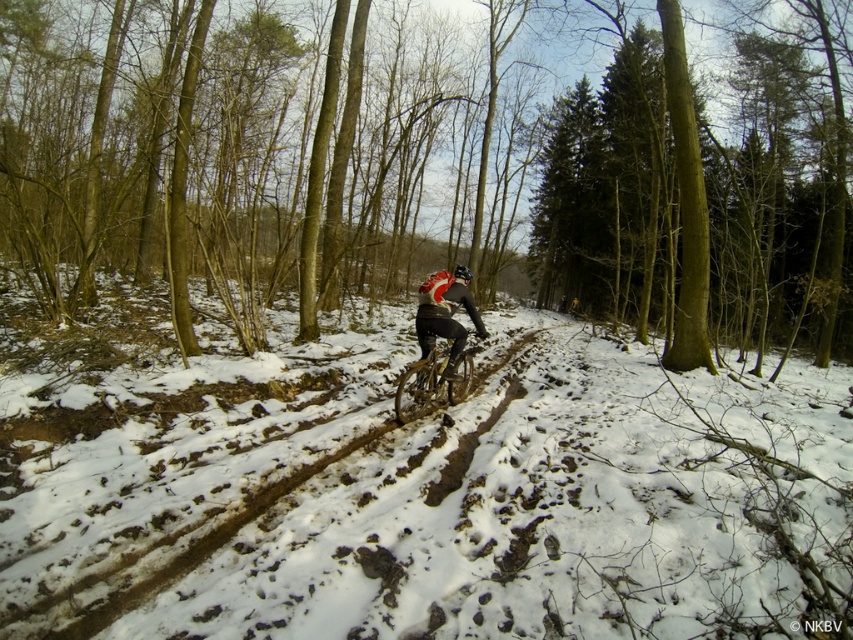
Who is taller, matte black cycling suit at center or shiny black bike at center?

matte black cycling suit at center

In the scene shown: Between matte black cycling suit at center and shiny black bike at center, which one has less height?

With less height is shiny black bike at center.

Locate an element on the screen. matte black cycling suit at center is located at coordinates tap(445, 314).

In the scene shown: Is white powdery snow at center shorter than matte black cycling suit at center?

Incorrect, white powdery snow at center's height does not fall short of matte black cycling suit at center's.

Based on the photo, does white powdery snow at center appear over matte black cycling suit at center?

Actually, white powdery snow at center is below matte black cycling suit at center.

Between point (212, 570) and point (457, 285), which one is positioned behind?

The point (457, 285) is behind.

Find the location of `white powdery snow at center`. white powdery snow at center is located at coordinates (408, 486).

Between white powdery snow at center and shiny black bike at center, which one appears on the right side from the viewer's perspective?

shiny black bike at center is more to the right.

Which is above, white powdery snow at center or shiny black bike at center?

Positioned higher is white powdery snow at center.

Image resolution: width=853 pixels, height=640 pixels. What are the coordinates of `white powdery snow at center` in the screenshot? It's located at (408, 486).